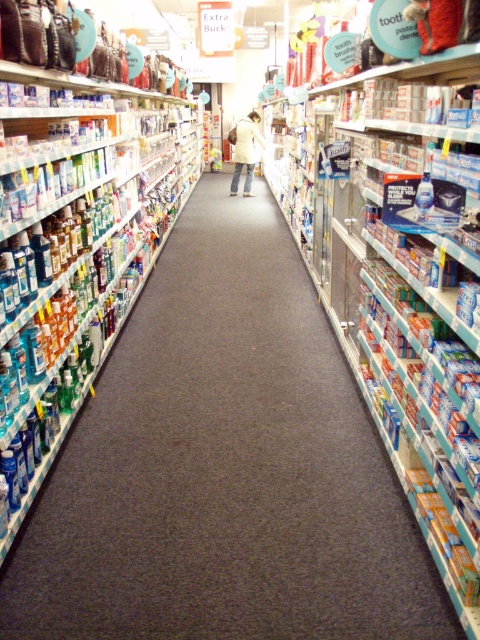
You are a delivery person who needs to place a new package on the shelf. The package is 1.5 meters long. You see the clear plastic bottles at center and the blue plastic toothpaste at center. Can you fit the package between them?

The clear plastic bottles at center and blue plastic toothpaste at center are 1.42 meters apart from each other. Since the package is 1.5 meters long, it cannot fit between them because the space is smaller than the package.

You are a customer in the store and want to grab both the clear plastic bottles at left and the white matte coat at center. Which one should you reach for first if you want to pick up the one closer to you?

The clear plastic bottles at left is positioned on the left side of white matte coat at center, so it is closer to you. You should reach for the clear plastic bottles at left first.